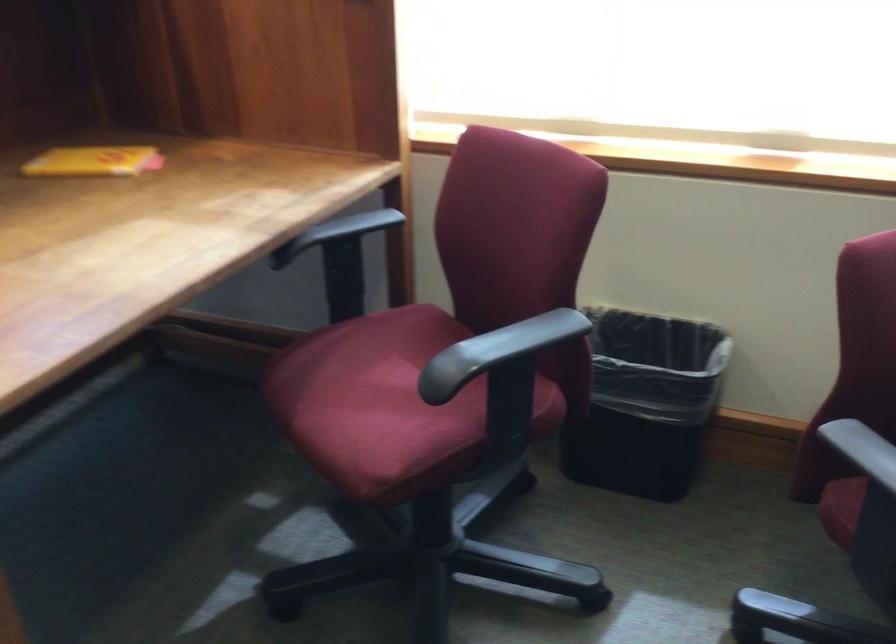
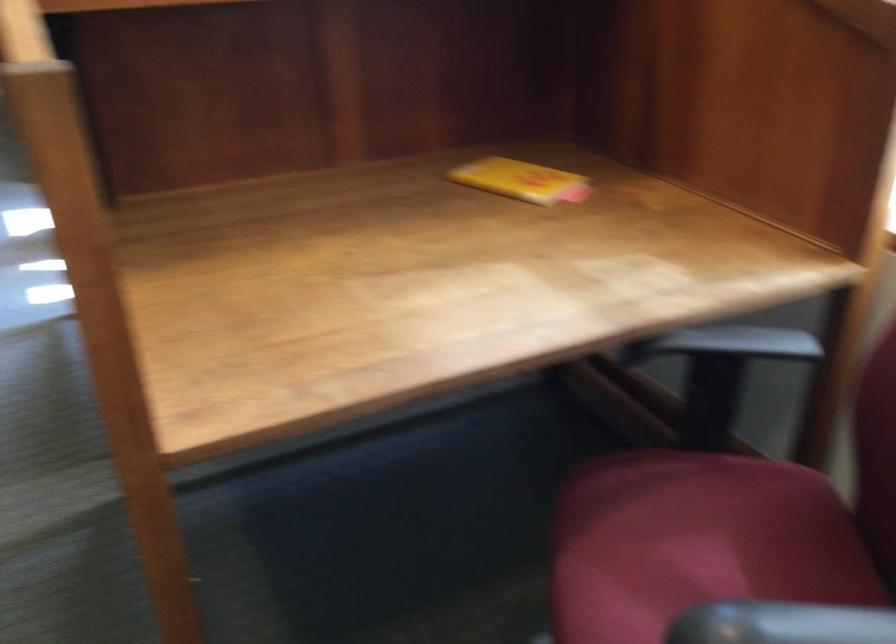
The point at (484, 348) is marked in the first image. Where is the corresponding point in the second image?

(780, 623)